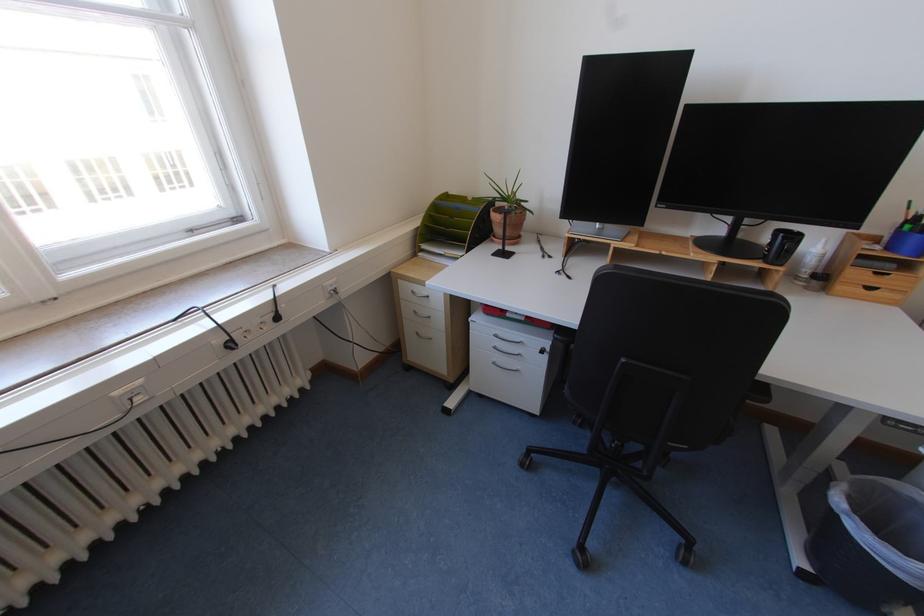
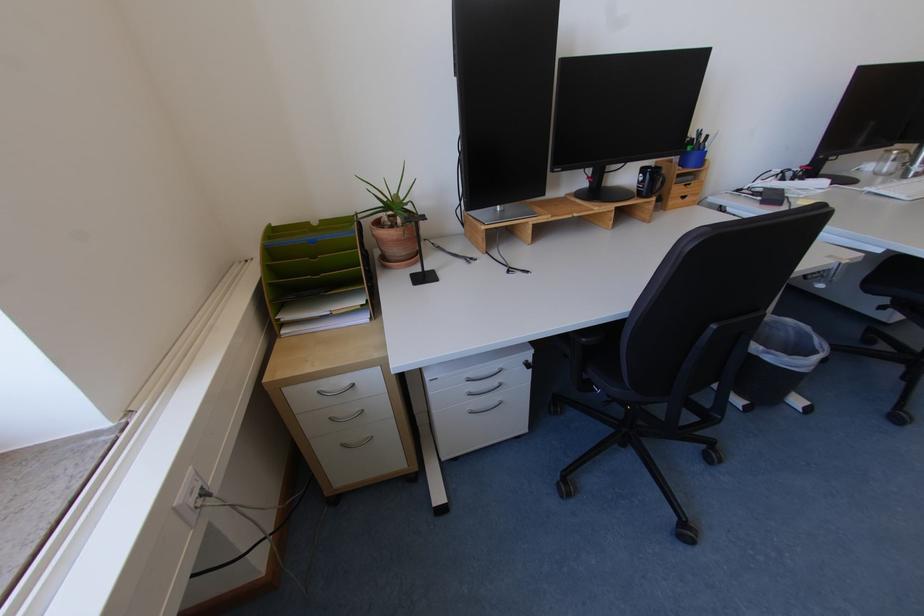
The point at (506, 222) is marked in the first image. Where is the corresponding point in the second image?

(403, 238)